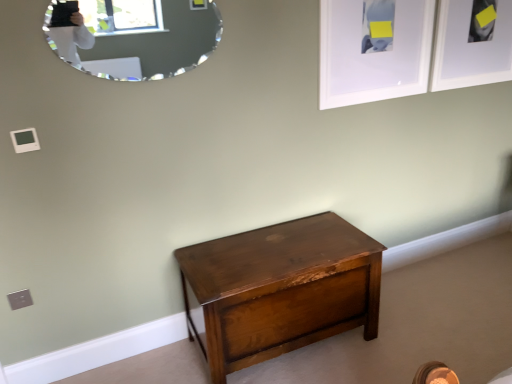
Question: Is silver-framed mirror at upper left to the left or to the right of shiny brown wood chest at center in the image?

Choices:
 (A) right
 (B) left

Answer: (B)

Question: From the image's perspective, is silver-framed mirror at upper left located above or below shiny brown wood chest at center?

Choices:
 (A) below
 (B) above

Answer: (B)

Question: Estimate the real-world distances between objects in this image. Which object is farther from the shiny brown wood chest at center?

Choices:
 (A) white matte picture frame at upper right, positioned as the first picture frame in right-to-left order
 (B) silver-framed mirror at upper left
 (C) white matte picture frame at upper right, the second picture frame when ordered from right to left

Answer: (A)

Question: Which object is positioned farthest from the shiny brown wood chest at center?

Choices:
 (A) white matte picture frame at upper right, the second picture frame when ordered from right to left
 (B) silver-framed mirror at upper left
 (C) white matte picture frame at upper right, positioned as the first picture frame in right-to-left order

Answer: (C)